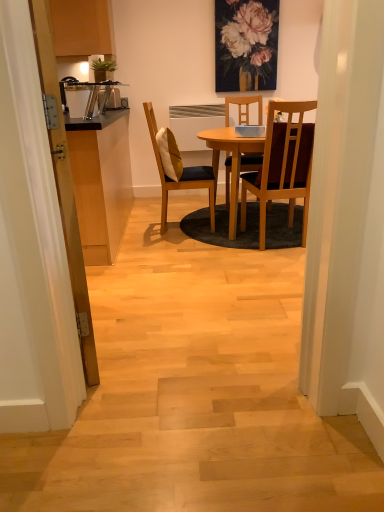
Locate an element on the screen. The image size is (384, 512). vacant space that's between wooden door at left and wooden chair at center, marked as the 2th chair in a left-to-right arrangement is located at coordinates (186, 289).